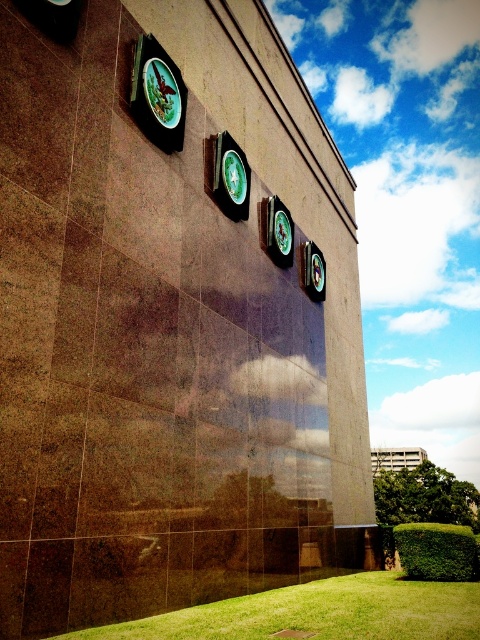
Question: Considering the real-world distances, which object is farthest from the matte green clock at upper left?

Choices:
 (A) green glossy clock at center
 (B) green grass at lower center

Answer: (B)

Question: Estimate the real-world distances between objects in this image. Which object is farther from the green grass at lower center?

Choices:
 (A) green glossy clock at center
 (B) matte green clock at upper left

Answer: (A)

Question: Does green grass at lower center appear under matte green clock at upper left?

Choices:
 (A) no
 (B) yes

Answer: (B)

Question: Which of these objects is positioned closest to the matte green clock at upper left?

Choices:
 (A) green glossy clock at center
 (B) green grass at lower center

Answer: (A)

Question: Is matte green clock at upper left closer to the viewer compared to green glossy clock at center?

Choices:
 (A) yes
 (B) no

Answer: (A)

Question: Can you confirm if matte green clock at upper left is positioned to the left of green glossy clock at center?

Choices:
 (A) no
 (B) yes

Answer: (B)